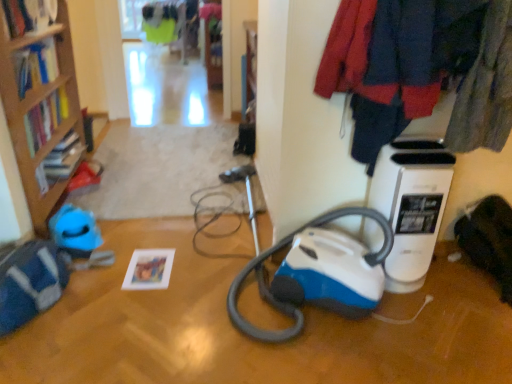
Where is `free space above white plastic air purifier at right (from a real-world perspective)`? The image size is (512, 384). free space above white plastic air purifier at right (from a real-world perspective) is located at coordinates (417, 149).